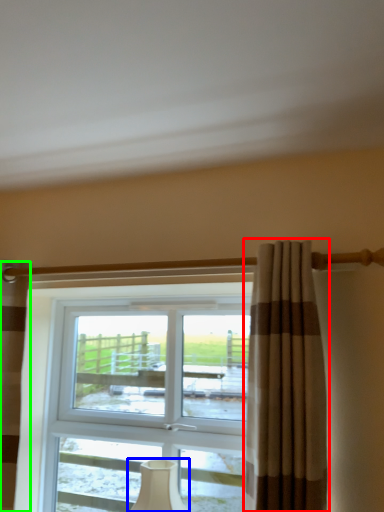
Question: Which object is the farthest from curtain (highlighted by a red box)? Choose among these: table lamp (highlighted by a blue box) or curtain (highlighted by a green box).

Choices:
 (A) table lamp
 (B) curtain

Answer: (B)